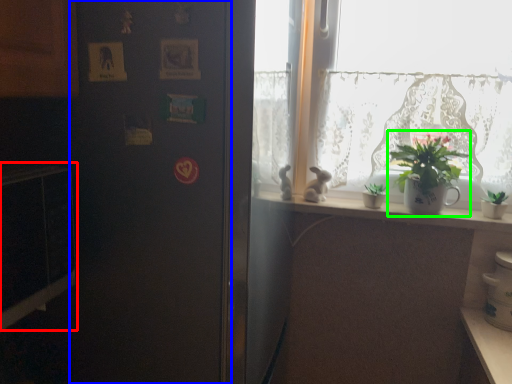
Question: Based on their relative distances, which object is farther from microwave (highlighted by a red box)? Choose from screen door (highlighted by a blue box) and houseplant (highlighted by a green box).

Choices:
 (A) screen door
 (B) houseplant

Answer: (B)